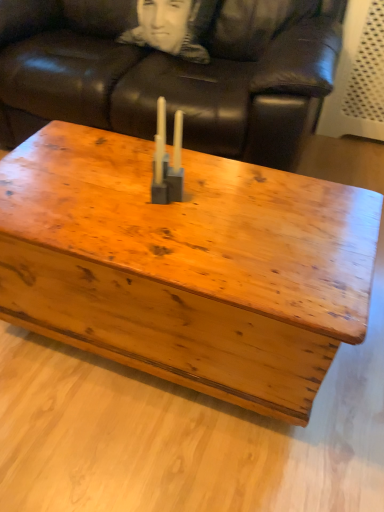
The image size is (384, 512). I want to click on free spot to the right of matte gray plastic candle holder at center, so click(229, 202).